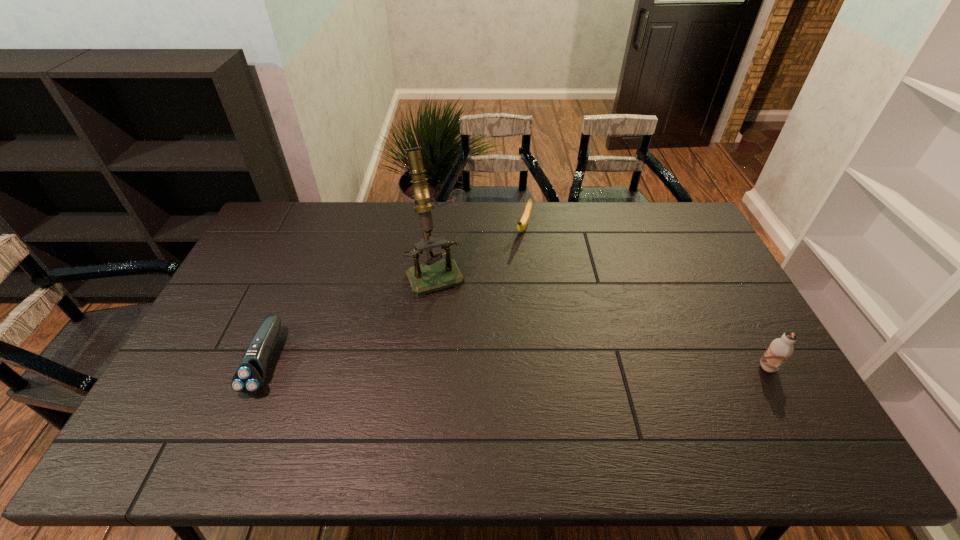
Locate an element on the screen. This screenshot has height=540, width=960. vacant space positioned at the stem of the third object from left to right is located at coordinates (516, 255).

Locate an element on the screen. This screenshot has width=960, height=540. vacant space situated 0.080m at the eyepiece of the third object from right to left is located at coordinates (454, 313).

Find the location of a particular element. free space located at the eyepiece of the third object from right to left is located at coordinates (474, 360).

The width and height of the screenshot is (960, 540). Identify the location of free space located at the eyepiece of the third object from right to left. [485, 383].

Where is `object present at the far edge`? The image size is (960, 540). object present at the far edge is located at coordinates (522, 224).

Locate an element on the screen. The width and height of the screenshot is (960, 540). object that is at the near edge is located at coordinates (250, 376).

Identify the location of object at the right edge. This screenshot has width=960, height=540. (780, 349).

Locate an element on the screen. This screenshot has width=960, height=540. vacant space at the far edge of the desktop is located at coordinates (464, 220).

In the image, there is a desktop. At what (x,y) coordinates should I click in order to perform the action: click on vacant space at the near edge. Please return your answer as a coordinate pair (x, y). This screenshot has height=540, width=960. Looking at the image, I should click on (349, 413).

This screenshot has height=540, width=960. In the image, there is a desktop. Identify the location of vacant space at the right edge. (731, 322).